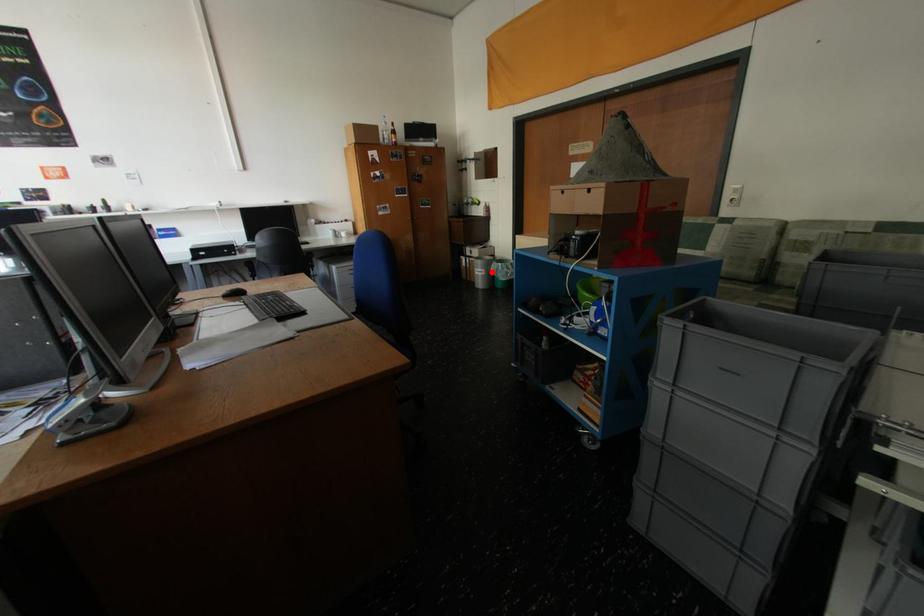
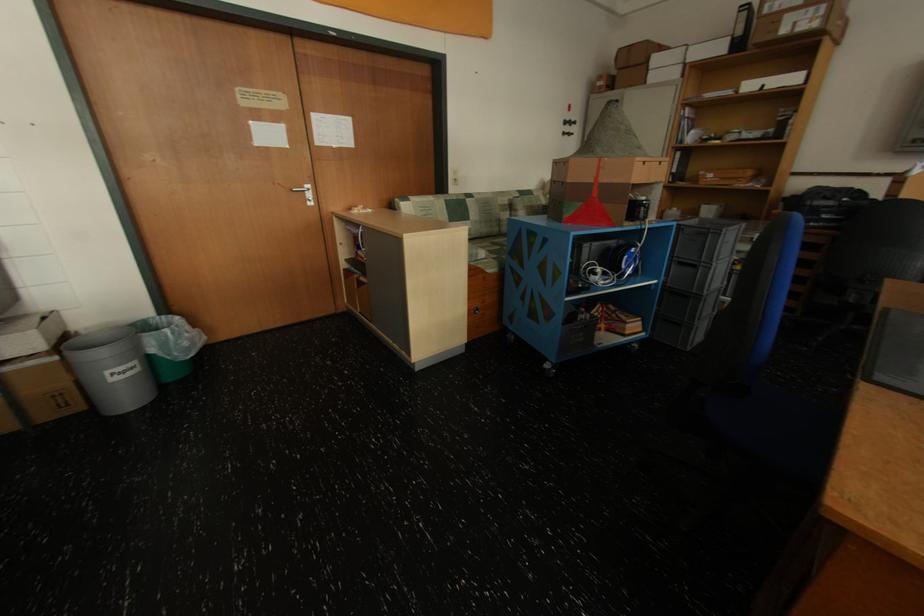
Find the pixel in the second image that matches the highlighted location in the first image.

(142, 363)